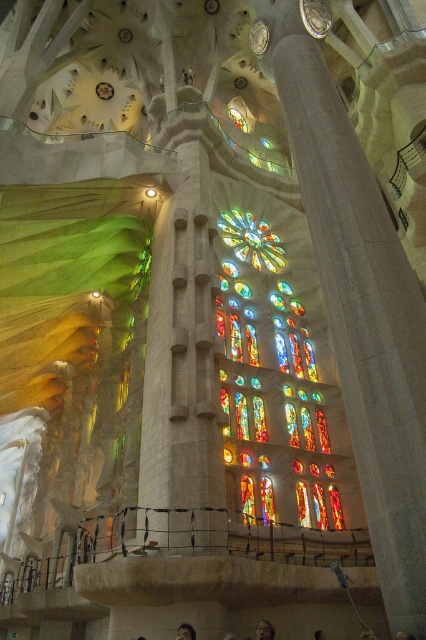
Is white stone column at center to the right of dark brown hair at lower center from the viewer's perspective?

Incorrect, white stone column at center is not on the right side of dark brown hair at lower center.

Between white stone column at center and dark brown hair at lower center, which one appears on the right side from the viewer's perspective?

dark brown hair at lower center is more to the right.

Is point (164, 442) more distant than point (262, 632)?

Yes.

In order to click on white stone column at center in this screenshot , I will do `click(184, 358)`.

Is stained glass window at center to the left of dark brown hair at lower center from the viewer's perspective?

No, stained glass window at center is not to the left of dark brown hair at lower center.

Does stained glass window at center have a greater width compared to dark brown hair at lower center?

Yes.

Between point (307, 449) and point (273, 628), which one is positioned in front?

Point (273, 628) is more forward.

Image resolution: width=426 pixels, height=640 pixels. In order to click on stained glass window at center in this screenshot , I will do `click(270, 388)`.

Can you confirm if smooth stone pillar at center is positioned above dark brown hair at lower center?

Correct, smooth stone pillar at center is located above dark brown hair at lower center.

Measure the distance between point (311, 13) and camera.

Point (311, 13) and camera are 62.76 meters apart.

Does point (353, 307) lie behind point (267, 636)?

No, it is in front of (267, 636).

The height and width of the screenshot is (640, 426). Find the location of `smooth stone pillar at center`. smooth stone pillar at center is located at coordinates point(357,298).